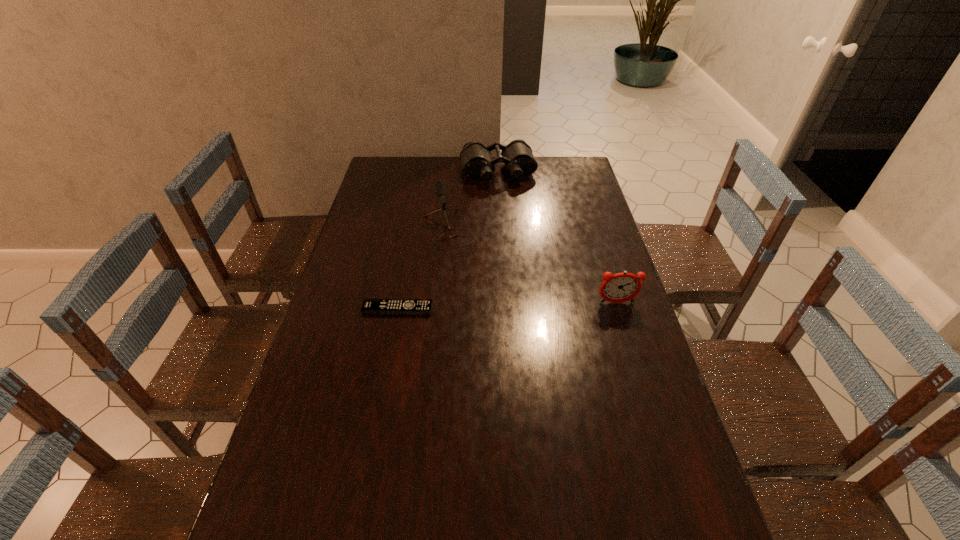
What are the coordinates of `free space on the desktop that is between the shortest object and the alarm clock and is positioned on the stand of the microphone` in the screenshot? It's located at (488, 306).

Find the location of a particular element. vacant space on the desktop that is between the shortest object and the alarm clock and is positioned through the eyepieces of the second shortest object is located at coordinates (534, 305).